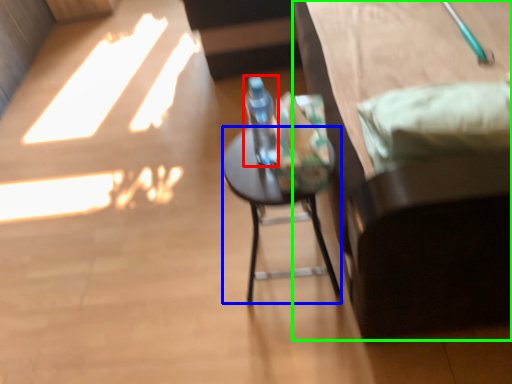
Question: Which object is positioned closest to bottle (highlighted by a red box)? Select from desk (highlighted by a blue box) and furniture (highlighted by a green box).

Choices:
 (A) desk
 (B) furniture

Answer: (A)